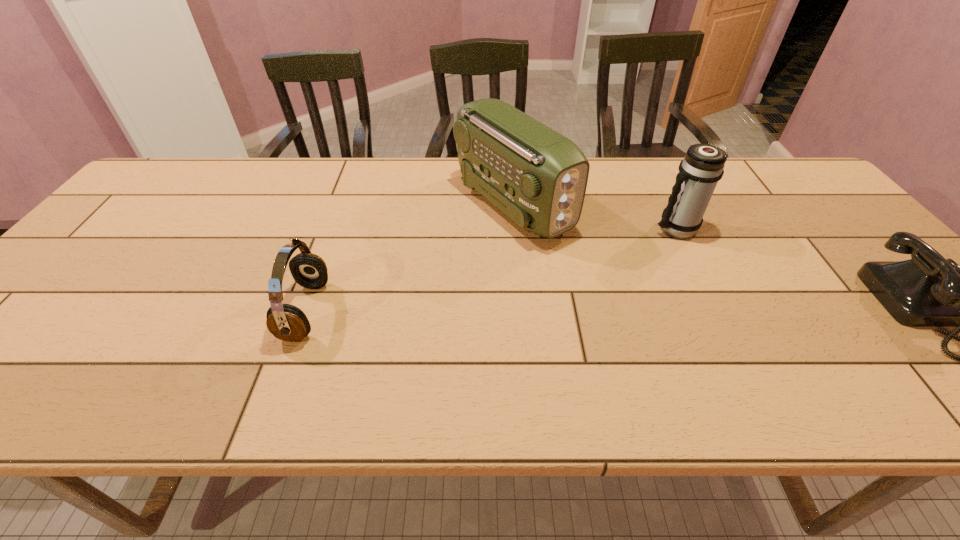
Find the location of a particular element. vacant area situated on the side with the handle of the second object from right to left is located at coordinates (646, 245).

Identify the location of free space located on the side with the handle of the second object from right to left. Image resolution: width=960 pixels, height=540 pixels. (636, 251).

The width and height of the screenshot is (960, 540). I want to click on vacant space situated 0.220m on the side with the handle of the second object from right to left, so click(606, 271).

Find the location of a particular element. The height and width of the screenshot is (540, 960). object present at the far edge is located at coordinates (536, 176).

Image resolution: width=960 pixels, height=540 pixels. Identify the location of object at the near edge. coord(286,322).

You are a GUI agent. You are given a task and a screenshot of the screen. Output one action in this format:
    pyautogui.click(x=<x>, y=<y>)
    Task: Click on the free space at the far edge of the desktop
    This screenshot has height=540, width=960.
    Given the screenshot: What is the action you would take?
    pyautogui.click(x=624, y=195)

Locate an element on the screen. vacant area at the near edge is located at coordinates (667, 356).

Find the location of a particular element. Image resolution: width=960 pixels, height=540 pixels. blank space at the right edge is located at coordinates (802, 200).

Locate an element on the screen. This screenshot has height=540, width=960. free point at the far left corner is located at coordinates click(x=215, y=159).

You are a GUI agent. You are given a task and a screenshot of the screen. Output one action in this format:
    pyautogui.click(x=<x>, y=<y>)
    Task: Click on the free point at the far right corner
    This screenshot has width=960, height=540.
    Given the screenshot: What is the action you would take?
    pyautogui.click(x=784, y=194)